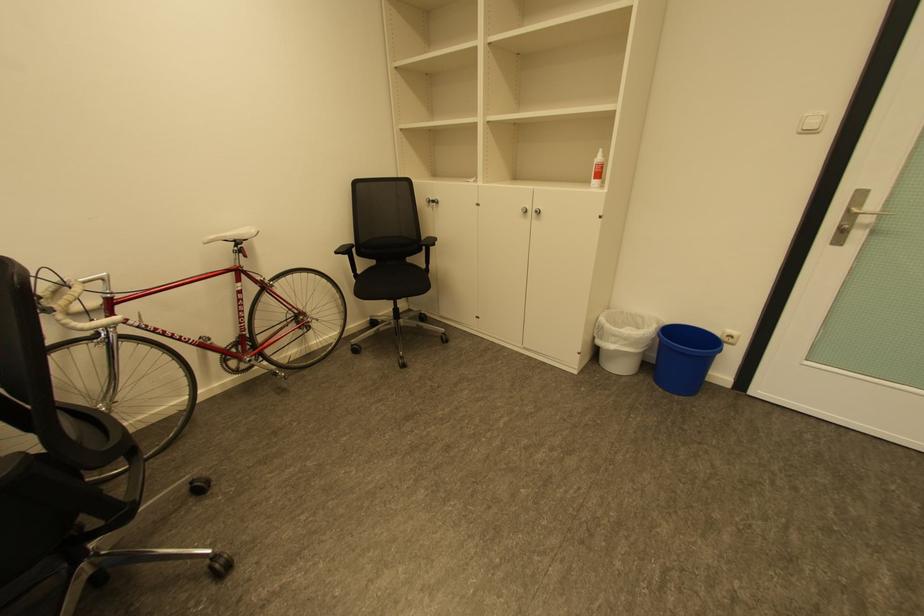
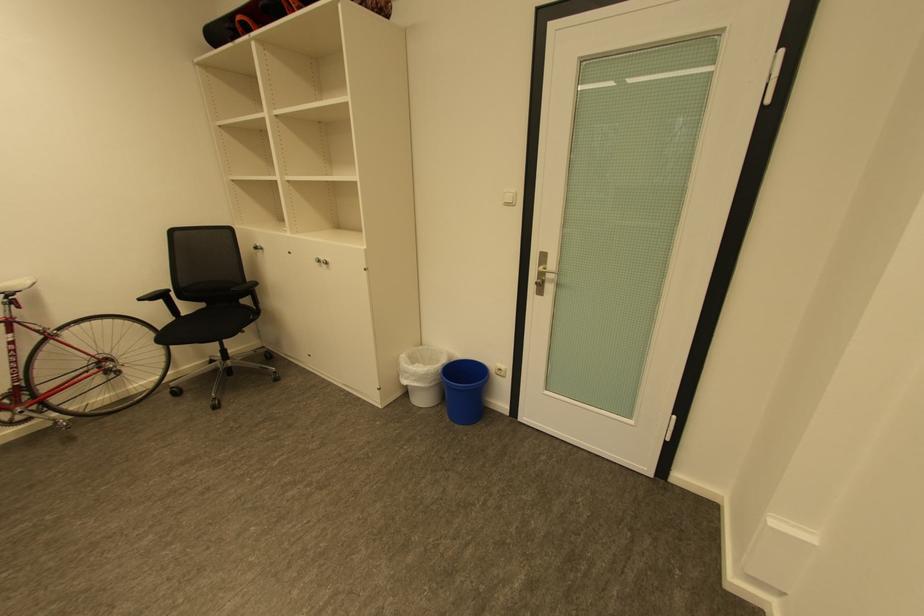
In the second image, find the point that corresponds to (x=622, y=337) in the first image.

(414, 373)